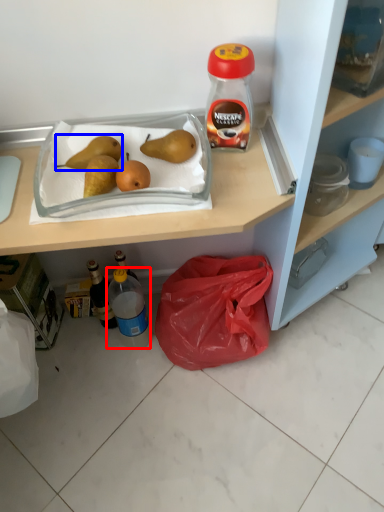
Question: Which object is closer to the camera taking this photo, bottle (highlighted by a red box) or pear (highlighted by a blue box)?

Choices:
 (A) bottle
 (B) pear

Answer: (B)